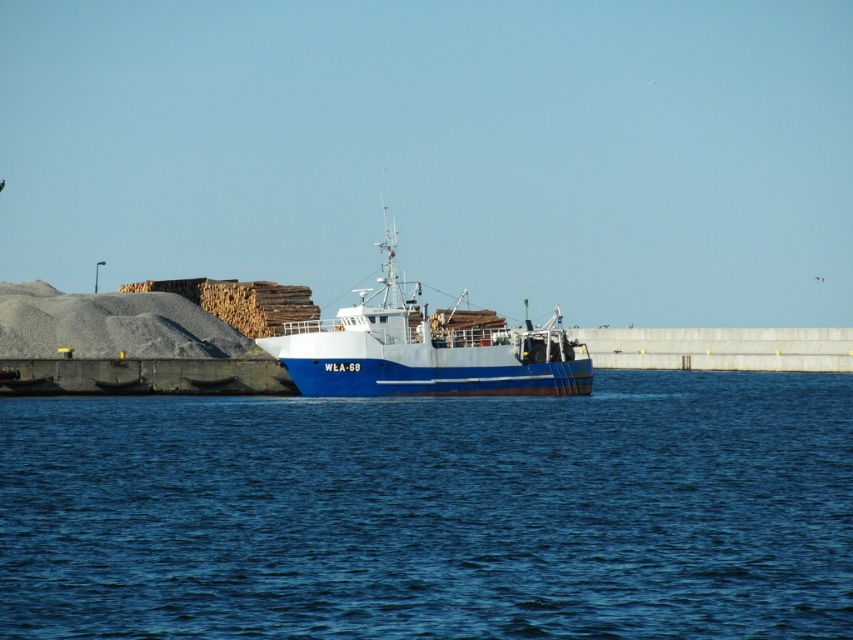
Question: Is blue water at center wider than blue matte boat at center?

Choices:
 (A) yes
 (B) no

Answer: (A)

Question: Is blue water at center closer to the viewer compared to blue matte boat at center?

Choices:
 (A) no
 (B) yes

Answer: (B)

Question: Which of the following is the closest to the observer?

Choices:
 (A) (550, 355)
 (B) (468, 573)

Answer: (B)

Question: Considering the relative positions of blue water at center and blue matte boat at center in the image provided, where is blue water at center located with respect to blue matte boat at center?

Choices:
 (A) right
 (B) left

Answer: (A)

Question: Which point is closer to the camera taking this photo?

Choices:
 (A) (395, 381)
 (B) (641, 508)

Answer: (B)

Question: Among these objects, which one is nearest to the camera?

Choices:
 (A) blue matte boat at center
 (B) blue water at center

Answer: (B)